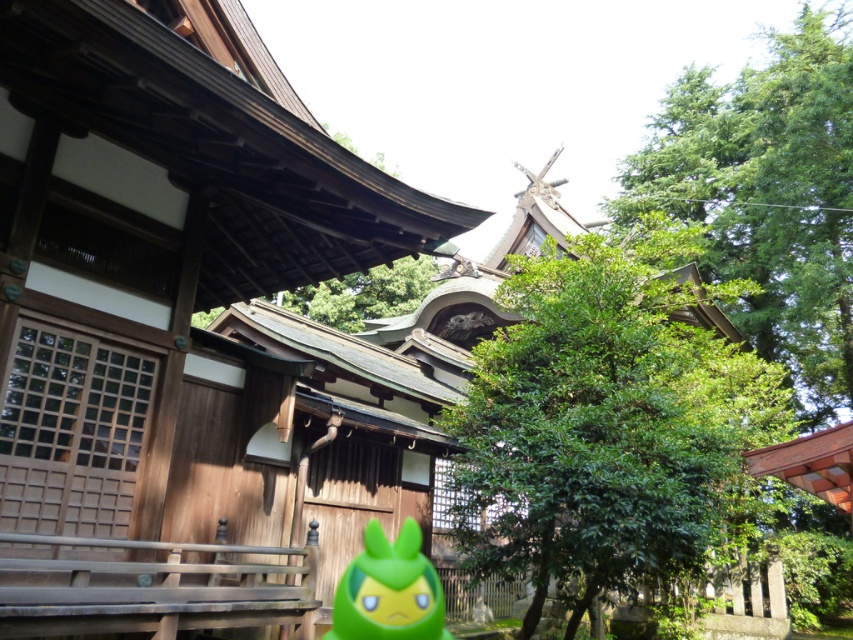
Question: Does green leafy tree at center appear under green leafy tree at upper right?

Choices:
 (A) yes
 (B) no

Answer: (A)

Question: Estimate the real-world distances between objects in this image. Which object is closer to the green rubber toy at center?

Choices:
 (A) green leafy tree at center
 (B) green leafy tree at upper right

Answer: (A)

Question: Which point is farther to the camera?

Choices:
 (A) (703, 218)
 (B) (415, 570)
 (C) (646, 369)

Answer: (A)

Question: Is the position of green leafy tree at upper right more distant than that of green rubber toy at center?

Choices:
 (A) yes
 (B) no

Answer: (A)

Question: Does green leafy tree at center have a larger size compared to green leafy tree at upper right?

Choices:
 (A) no
 (B) yes

Answer: (A)

Question: Estimate the real-world distances between objects in this image. Which object is farther from the green rubber toy at center?

Choices:
 (A) green leafy tree at center
 (B) green leafy tree at upper right

Answer: (B)